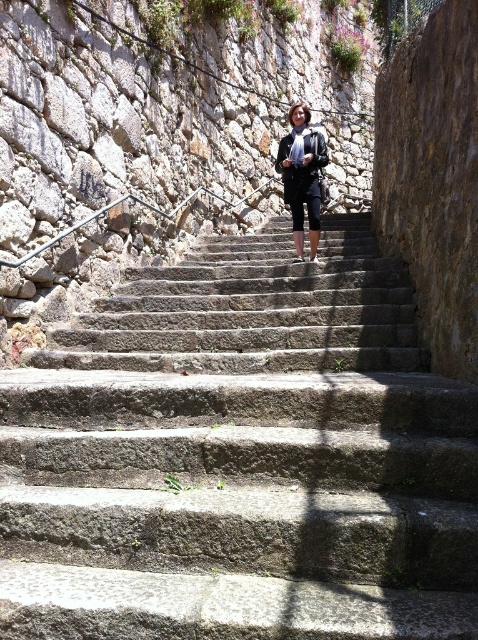
Does gray stone stairs at center have a smaller size compared to black leather jacket at center?

Actually, gray stone stairs at center might be larger than black leather jacket at center.

Is gray stone stairs at center positioned at the back of black leather jacket at center?

No, it is not.

Does point (18, 566) come behind point (302, 220)?

That is False.

Where is `gray stone stairs at center`? This screenshot has width=478, height=640. gray stone stairs at center is located at coordinates tap(240, 456).